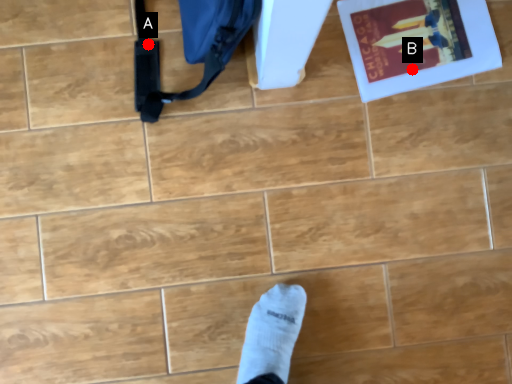
Question: Two points are circled on the image, labeled by A and B beside each circle. Among these points, which one is nearest to the camera?

Choices:
 (A) A is closer
 (B) B is closer

Answer: (A)